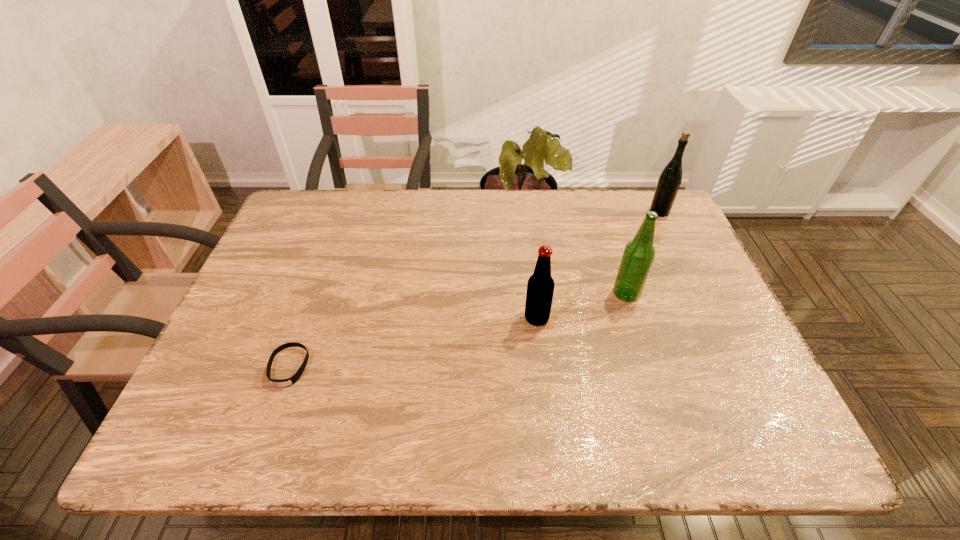
Where is `blank space located 0.190m on the label of the third object from left to right`? The height and width of the screenshot is (540, 960). blank space located 0.190m on the label of the third object from left to right is located at coordinates (537, 294).

What are the coordinates of `vacant space situated on the label of the third object from left to right` in the screenshot? It's located at (490, 294).

The image size is (960, 540). In order to click on vacant space situated 0.390m on the back of the leftmost beer bottle in this screenshot , I will do `click(524, 213)`.

The height and width of the screenshot is (540, 960). Identify the location of vacant area located on the display of the shortest object. (267, 429).

Find the location of a particular element. This screenshot has height=540, width=960. object that is at the far edge is located at coordinates (670, 178).

You are a GUI agent. You are given a task and a screenshot of the screen. Output one action in this format:
    pyautogui.click(x=<x>, y=<y>)
    Task: Click on the object positioned at the left edge
    The height and width of the screenshot is (540, 960).
    Given the screenshot: What is the action you would take?
    pyautogui.click(x=290, y=381)

I want to click on object that is positioned at the right edge, so click(670, 178).

Image resolution: width=960 pixels, height=540 pixels. Find the location of `object present at the far right corner`. object present at the far right corner is located at coordinates (670, 178).

This screenshot has width=960, height=540. In the image, there is a desktop. What are the coordinates of `vacant space at the far edge` in the screenshot? It's located at (410, 226).

What are the coordinates of `free spot at the near edge of the desktop` in the screenshot? It's located at (540, 442).